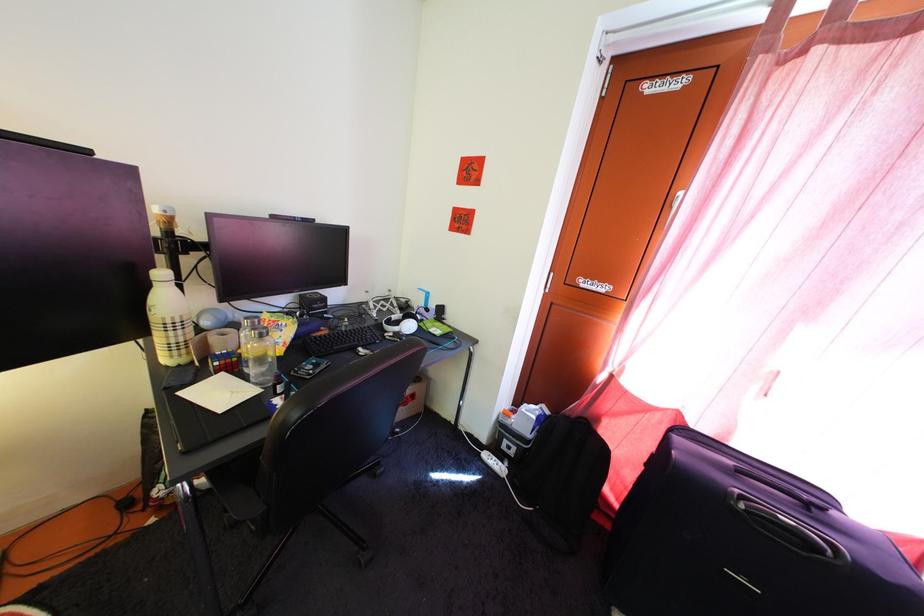
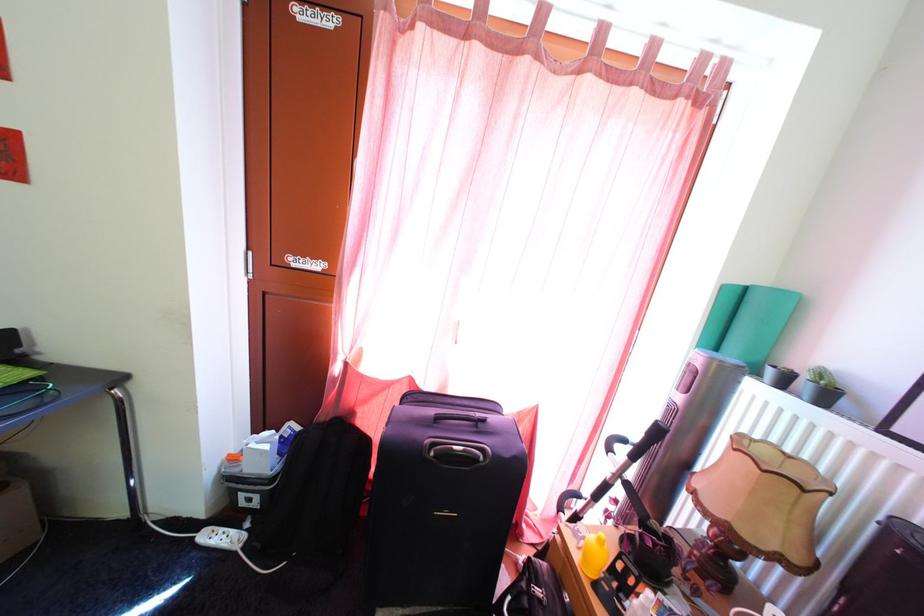
Find the pixel in the second image that matches point (520, 461) in the first image.

(264, 512)